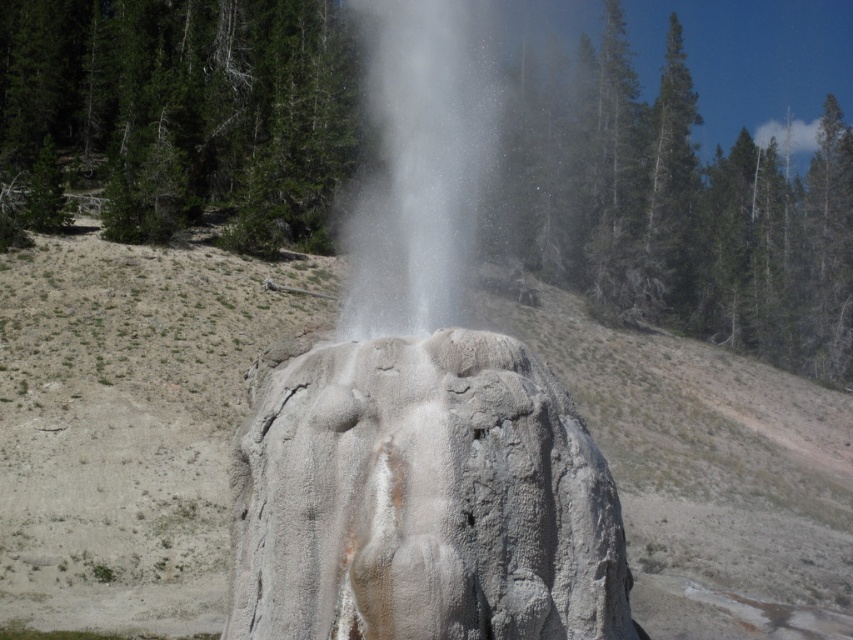
Question: Does white textured rock at center come behind gray textured rock at center?

Choices:
 (A) no
 (B) yes

Answer: (B)

Question: Which of the following is the closest to the observer?

Choices:
 (A) (76, 467)
 (B) (404, 374)
 (C) (529, 444)

Answer: (C)

Question: Which object is closer to the camera taking this photo?

Choices:
 (A) white vapor at center
 (B) gray textured rock at center
 (C) white textured rock at center

Answer: (B)

Question: Is gray rock formation at center to the right of gray textured rock at center from the viewer's perspective?

Choices:
 (A) yes
 (B) no

Answer: (A)

Question: Which of the following is the farthest from the observer?

Choices:
 (A) (248, 536)
 (B) (103, 588)

Answer: (B)

Question: Does gray rock formation at center have a lesser width compared to gray textured rock at center?

Choices:
 (A) yes
 (B) no

Answer: (B)